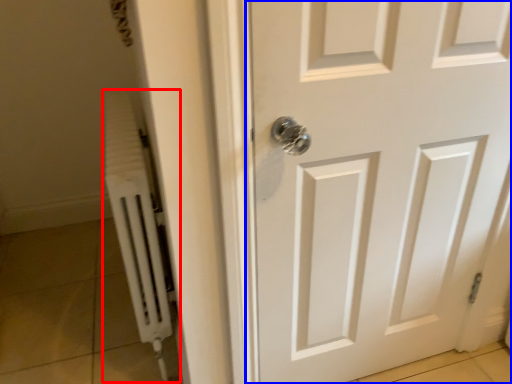
Question: Among these objects, which one is nearest to the camera, radiator (highlighted by a red box) or door (highlighted by a blue box)?

Choices:
 (A) radiator
 (B) door

Answer: (B)